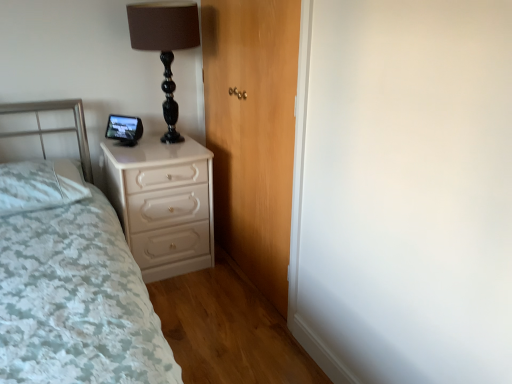
Question: Does white soft pillow at left have a greater width compared to white textured bed at left?

Choices:
 (A) yes
 (B) no

Answer: (B)

Question: From the image's perspective, is white soft pillow at left beneath white textured bed at left?

Choices:
 (A) no
 (B) yes

Answer: (A)

Question: Are white soft pillow at left and white textured bed at left beside each other?

Choices:
 (A) no
 (B) yes

Answer: (A)

Question: Does white soft pillow at left turn towards white textured bed at left?

Choices:
 (A) yes
 (B) no

Answer: (A)

Question: Is white soft pillow at left positioned behind white textured bed at left?

Choices:
 (A) no
 (B) yes

Answer: (B)

Question: Is white soft pillow at left far away from white textured bed at left?

Choices:
 (A) no
 (B) yes

Answer: (A)

Question: Is white soft pillow at left thinner than wooden door at center?

Choices:
 (A) yes
 (B) no

Answer: (B)

Question: Is white soft pillow at left far away from wooden door at center?

Choices:
 (A) no
 (B) yes

Answer: (A)

Question: From the image's perspective, is white soft pillow at left beneath wooden door at center?

Choices:
 (A) no
 (B) yes

Answer: (B)

Question: Considering the relative sizes of white soft pillow at left and wooden door at center in the image provided, is white soft pillow at left bigger than wooden door at center?

Choices:
 (A) no
 (B) yes

Answer: (A)

Question: From the image's perspective, would you say white soft pillow at left is positioned over wooden door at center?

Choices:
 (A) no
 (B) yes

Answer: (A)

Question: Is white soft pillow at left shorter than wooden door at center?

Choices:
 (A) no
 (B) yes

Answer: (B)

Question: Is white glossy chest of drawers at lower left far from white soft pillow at left?

Choices:
 (A) no
 (B) yes

Answer: (A)